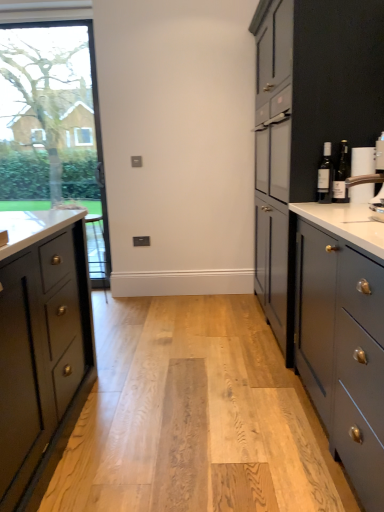
Question: Is clear glass window at left in front of or behind matte gray cabinets at right in the image?

Choices:
 (A) behind
 (B) front

Answer: (A)

Question: Considering the positions of point (74, 91) and point (350, 144), is point (74, 91) closer or farther from the camera than point (350, 144)?

Choices:
 (A) farther
 (B) closer

Answer: (A)

Question: Based on their relative distances, which object is farther from the matte glass bottle at right, which is counted as the second bottle, starting from the left?

Choices:
 (A) matte glass bottle at right, which is counted as the 2th bottle, starting from the right
 (B) white glossy coffee machine at upper right
 (C) matte gray cabinets at right
 (D) clear glass window at left

Answer: (D)

Question: Which is farther from the matte gray cabinets at right?

Choices:
 (A) matte glass bottle at right, acting as the first bottle starting from the left
 (B) matte glass bottle at right, the 1th bottle viewed from the right
 (C) white glossy coffee machine at upper right
 (D) clear glass window at left

Answer: (D)